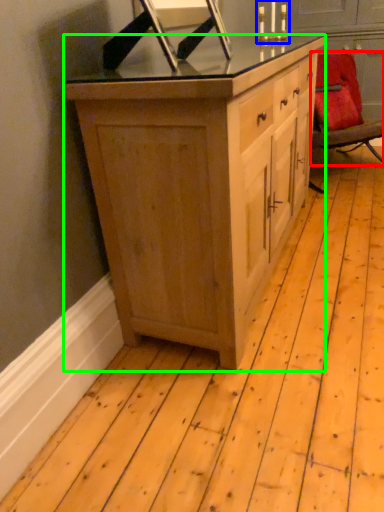
Question: Based on their relative distances, which object is nearer to chair (highlighted by a red box)? Choose from candle holder (highlighted by a blue box) and cabinetry (highlighted by a green box).

Choices:
 (A) candle holder
 (B) cabinetry

Answer: (A)